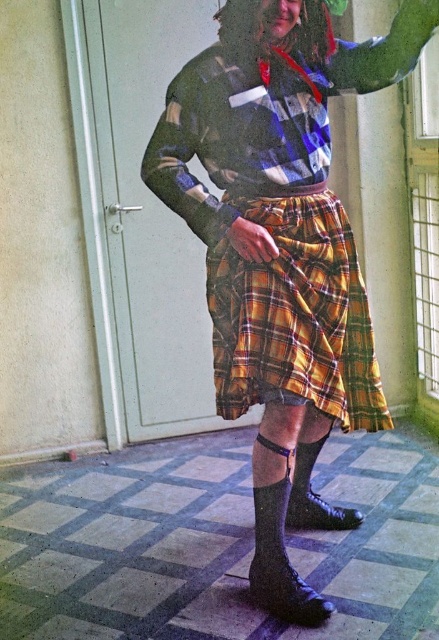
Question: Among these objects, which one is farthest from the camera?

Choices:
 (A) yellow plaid kilt at center
 (B) black matte sock at lower center
 (C) black suede sock at lower center
 (D) yellow plaid skirt at center

Answer: (B)

Question: Can you confirm if yellow plaid skirt at center is positioned to the right of black suede sock at lower center?

Choices:
 (A) no
 (B) yes

Answer: (A)

Question: In this image, where is yellow plaid skirt at center located relative to black matte sock at lower center?

Choices:
 (A) below
 (B) above

Answer: (B)

Question: Which point is farther from the camera taking this photo?

Choices:
 (A) (276, 605)
 (B) (215, 52)

Answer: (A)

Question: Considering the real-world distances, which object is farthest from the black matte sock at lower center?

Choices:
 (A) yellow plaid kilt at center
 (B) yellow plaid skirt at center
 (C) black suede sock at lower center

Answer: (B)

Question: Does yellow plaid kilt at center appear over black matte sock at lower center?

Choices:
 (A) yes
 (B) no

Answer: (A)